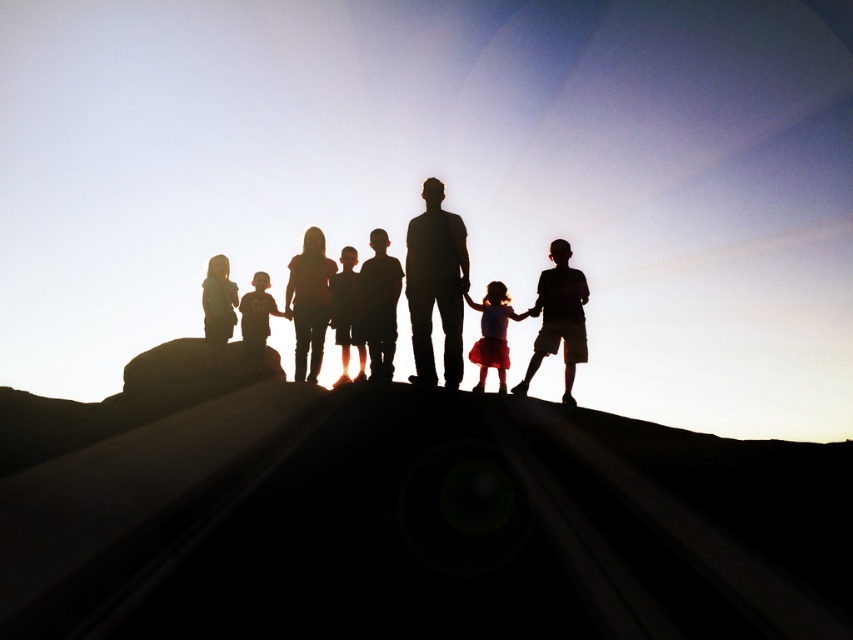
You are a photographer trying to capture the entire group of people on the railway tracks in the scene. The camera you are using has a maximum focus range of 5 feet. Can you fit both the matte black girl at center and the silhouette child at center in the same frame without moving the camera?

The distance between the matte black girl at center and the silhouette child at center is 5.50 feet, which exceeds the camera maximum focus range of 5 feet. Therefore, you cannot fit both in the same frame without moving the camera.

You are standing at the point marked as point [299,264] in the image. The railway tracks extend into the distance. If you walk straight ahead along the tracks, how far will you have to walk to reach the horizon where the tracks converge?

The distance of point [299,264] from viewer is 34.58 feet, so you will have to walk 34.58 feet to reach the horizon where the tracks converge.

In the scene shown: You are a photographer trying to capture the perfect shot of the matte black child at center. Given the coordinates provided in the scene description, can you determine if the child is positioned exactly at the center of the image?

The matte black child at center is located at coordinates point (379, 305), which are very close to the center of the image, so yes, the child is positioned at the center.